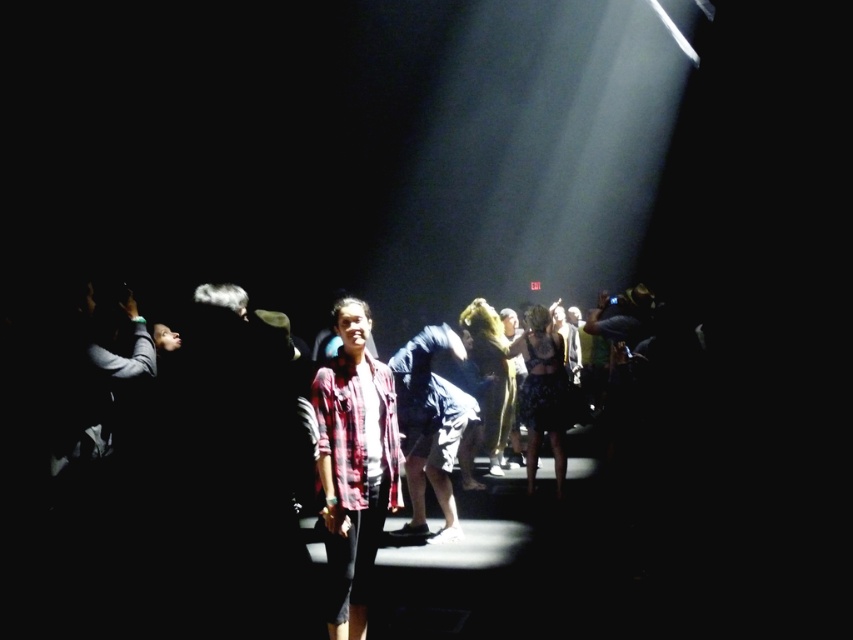
Which is below, plaid fabric shirt at center or denim shorts at center?

denim shorts at center

Is plaid fabric shirt at center thinner than denim shorts at center?

Yes.

From the picture: Who is more distant from viewer, (x=381, y=436) or (x=454, y=390)?

Positioned behind is point (x=454, y=390).

In order to click on plaid fabric shirt at center in this screenshot , I will do `click(354, 465)`.